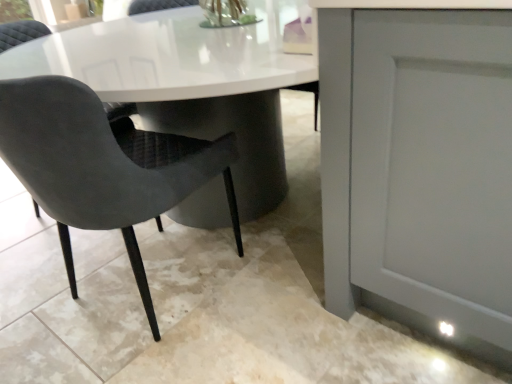
What do you see at coordinates (102, 166) in the screenshot? The width and height of the screenshot is (512, 384). I see `suede gray chair at lower left` at bounding box center [102, 166].

Locate an element on the screen. suede gray chair at lower left is located at coordinates (102, 166).

Locate an element on the screen. The height and width of the screenshot is (384, 512). suede gray chair at lower left is located at coordinates (102, 166).